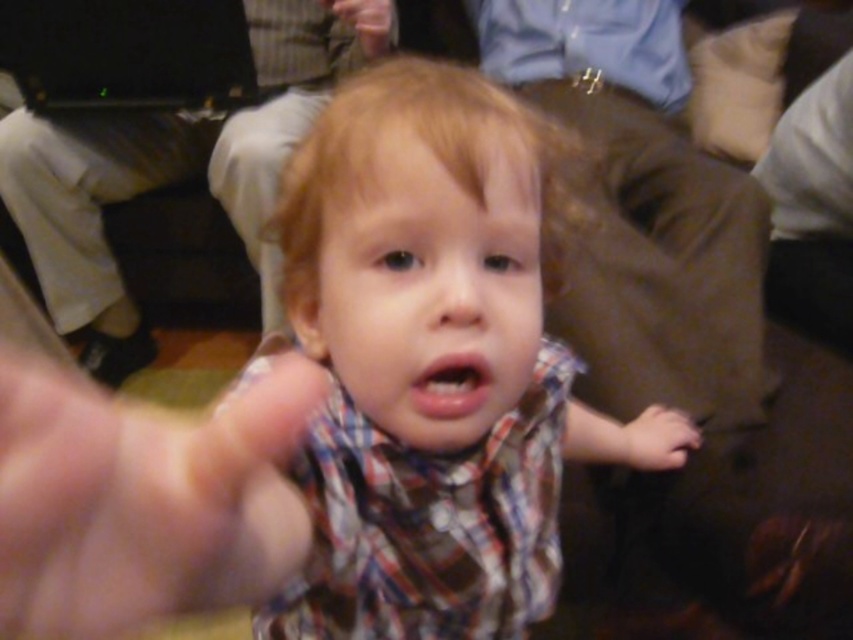
Question: Is plaid fabric toddler at center thinner than flesh-toned skin at center?

Choices:
 (A) no
 (B) yes

Answer: (A)

Question: Among these points, which one is farthest from the camera?

Choices:
 (A) (317, 358)
 (B) (0, 387)

Answer: (A)

Question: Which point is farther from the camera taking this photo?

Choices:
 (A) (102, 596)
 (B) (357, 461)

Answer: (B)

Question: Which point is closer to the camera?

Choices:
 (A) (32, 490)
 (B) (366, 259)

Answer: (A)

Question: Does plaid fabric toddler at center appear under flesh-toned skin at center?

Choices:
 (A) no
 (B) yes

Answer: (B)

Question: Is the position of plaid fabric toddler at center more distant than that of flesh-toned skin at center?

Choices:
 (A) no
 (B) yes

Answer: (B)